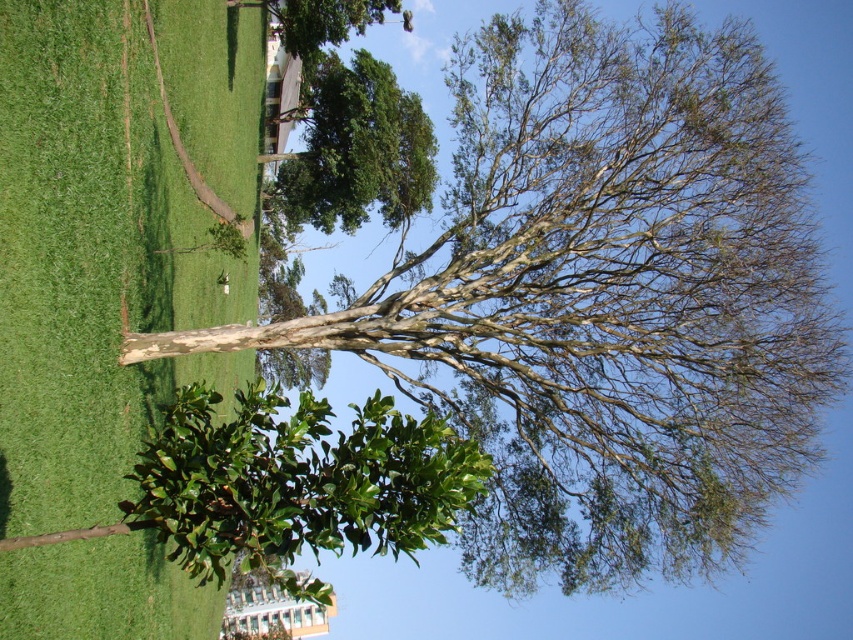
Question: Among these points, which one is farthest from the camera?

Choices:
 (A) (125, 296)
 (B) (332, 490)
 (C) (366, 154)

Answer: (C)

Question: Which point is farther to the camera?

Choices:
 (A) green grass at center
 (B) green leafy bush at lower left
 (C) green leafy tree at upper center

Answer: (C)

Question: Is green grass at center further to camera compared to green leafy tree at upper center?

Choices:
 (A) yes
 (B) no

Answer: (B)

Question: Considering the relative positions of green leafy bush at lower left and green leafy tree at upper center in the image provided, where is green leafy bush at lower left located with respect to green leafy tree at upper center?

Choices:
 (A) left
 (B) right

Answer: (B)

Question: Which is nearer to the green leafy tree at upper center?

Choices:
 (A) green grass at center
 (B) green leafy bush at lower left

Answer: (A)

Question: Does green leafy bush at lower left have a smaller size compared to green leafy tree at upper center?

Choices:
 (A) no
 (B) yes

Answer: (A)